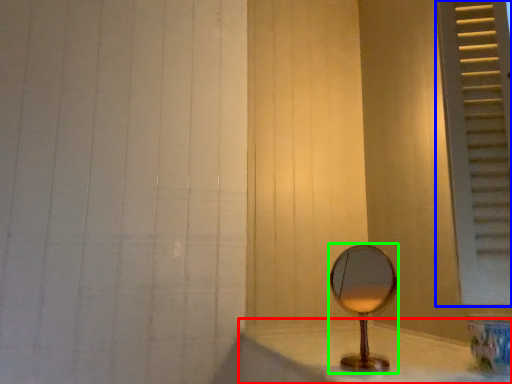
Question: Which is nearer to the counter top (highlighted by a red box)? window frame (highlighted by a blue box) or mirror (highlighted by a green box).

Choices:
 (A) window frame
 (B) mirror

Answer: (B)